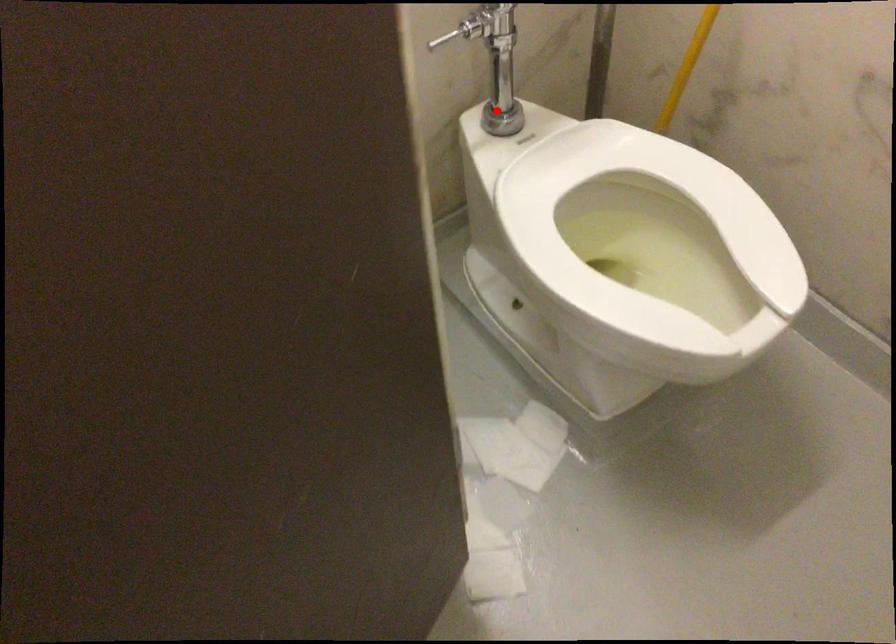
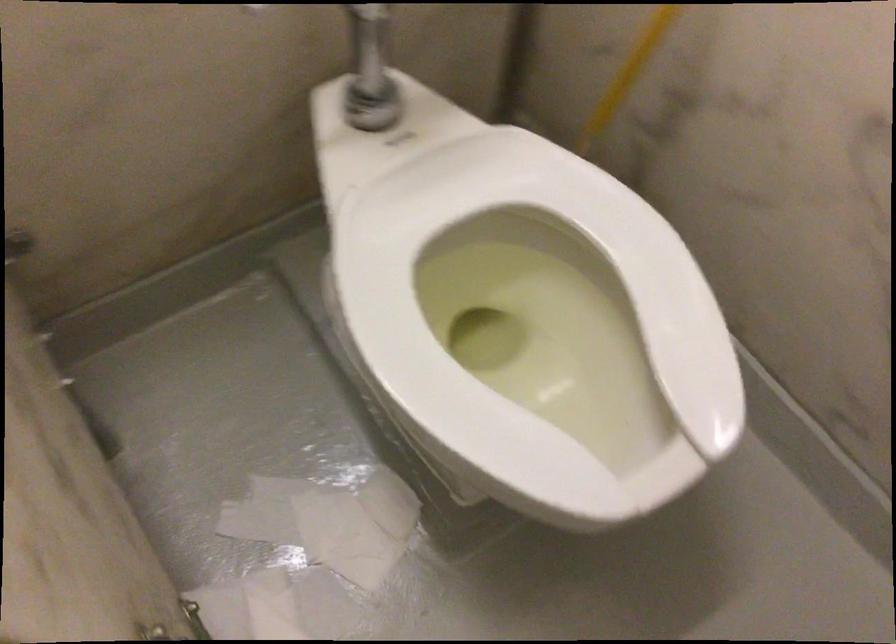
Find the pixel in the second image that matches the highlighted location in the first image.

(362, 96)